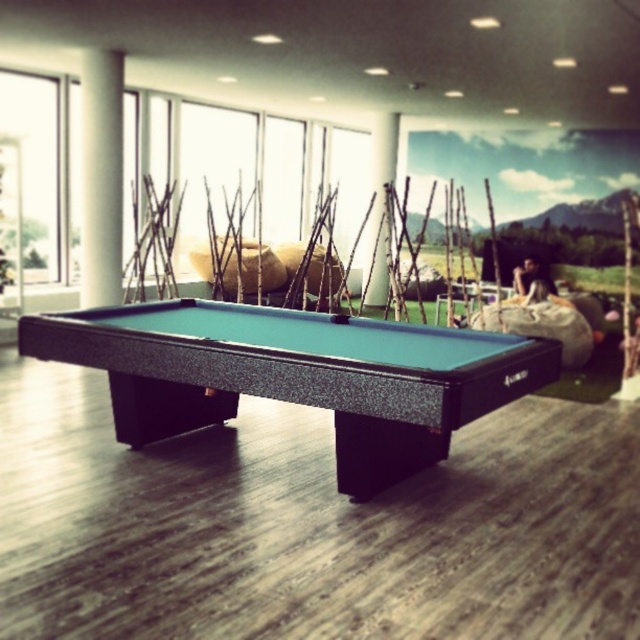
Question: Is green felt pool table at center smaller than transparent glass window at upper left?

Choices:
 (A) no
 (B) yes

Answer: (A)

Question: Which object appears farthest from the camera in this image?

Choices:
 (A) white glossy column at upper left
 (B) transparent glass window at upper left
 (C) green felt pool table at center

Answer: (B)

Question: Which of these objects is positioned farthest from the green felt pool table at center?

Choices:
 (A) transparent glass window at upper left
 (B) white matte pillar at center
 (C) white glossy column at upper left

Answer: (B)

Question: Among these points, which one is nearest to the camera?

Choices:
 (A) (92, 205)
 (B) (392, 150)

Answer: (A)

Question: Can you confirm if green felt pool table at center is positioned to the right of white matte pillar at center?

Choices:
 (A) yes
 (B) no

Answer: (B)

Question: Can you confirm if green felt pool table at center is thinner than transparent glass window at upper left?

Choices:
 (A) no
 (B) yes

Answer: (A)